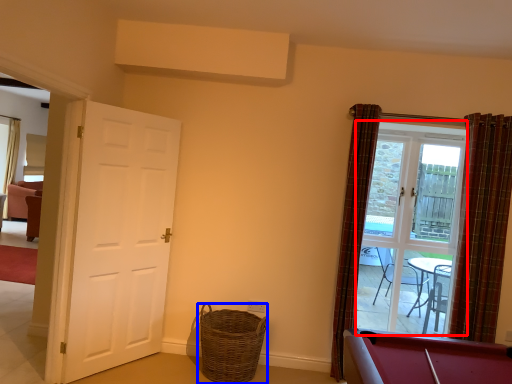
Question: Which object appears closest to the camera in this image, glass door (highlighted by a red box) or basket (highlighted by a blue box)?

Choices:
 (A) glass door
 (B) basket

Answer: (B)